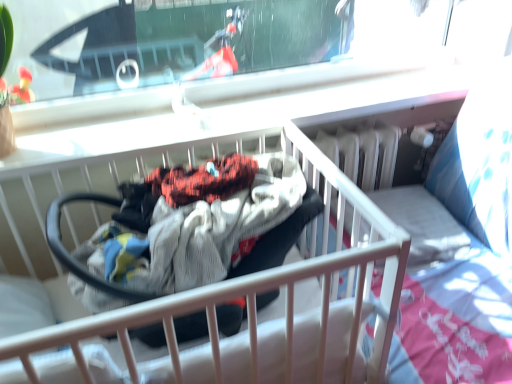
Question: From the image's perspective, is black rubber baby carriage at center below white fabric infant bed at center?

Choices:
 (A) yes
 (B) no

Answer: (B)

Question: Is white fabric infant bed at center located within black rubber baby carriage at center?

Choices:
 (A) yes
 (B) no

Answer: (B)

Question: Considering the relative sizes of black rubber baby carriage at center and white fabric infant bed at center in the image provided, is black rubber baby carriage at center smaller than white fabric infant bed at center?

Choices:
 (A) yes
 (B) no

Answer: (A)

Question: Is black rubber baby carriage at center not near white fabric infant bed at center?

Choices:
 (A) yes
 (B) no

Answer: (B)

Question: Is black rubber baby carriage at center closer to the viewer compared to white fabric infant bed at center?

Choices:
 (A) no
 (B) yes

Answer: (A)

Question: Is black rubber baby carriage at center to the left of white fabric infant bed at center from the viewer's perspective?

Choices:
 (A) no
 (B) yes

Answer: (A)

Question: Can black rubber baby carriage at center be found inside white fabric infant bed at center?

Choices:
 (A) no
 (B) yes

Answer: (B)

Question: Considering the relative sizes of white fabric infant bed at center and black rubber baby carriage at center in the image provided, is white fabric infant bed at center taller than black rubber baby carriage at center?

Choices:
 (A) no
 (B) yes

Answer: (B)

Question: From the image's perspective, is white fabric infant bed at center above black rubber baby carriage at center?

Choices:
 (A) no
 (B) yes

Answer: (A)

Question: Is white fabric infant bed at center facing away from black rubber baby carriage at center?

Choices:
 (A) no
 (B) yes

Answer: (B)

Question: From a real-world perspective, is white fabric infant bed at center located higher than black rubber baby carriage at center?

Choices:
 (A) yes
 (B) no

Answer: (B)

Question: From the image's perspective, does white fabric infant bed at center appear lower than black rubber baby carriage at center?

Choices:
 (A) no
 (B) yes

Answer: (B)

Question: From a real-world perspective, is white fabric infant bed at center above or below black rubber baby carriage at center?

Choices:
 (A) above
 (B) below

Answer: (B)